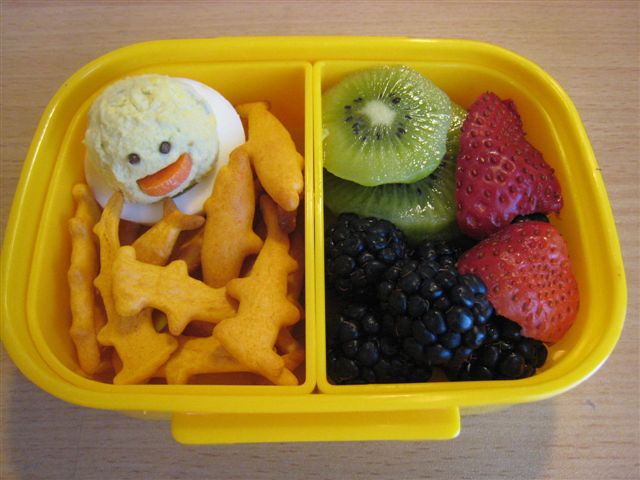
This screenshot has width=640, height=480. I want to click on light wood table top, so click(470, 445).